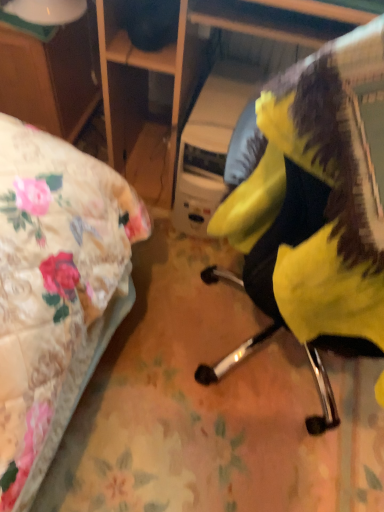
Image resolution: width=384 pixels, height=512 pixels. Describe the element at coordinates (317, 199) in the screenshot. I see `yellow fabric chair at center` at that location.

I want to click on yellow fabric chair at center, so click(317, 199).

You are a GUI agent. You are given a task and a screenshot of the screen. Output one action in this format:
    pyautogui.click(x=<x>, y=<y>)
    Task: Click on the wooden desk at left
    The height and width of the screenshot is (512, 384).
    Given the screenshot: What is the action you would take?
    pyautogui.click(x=51, y=76)

Describe the element at coordinates (51, 76) in the screenshot. I see `wooden desk at left` at that location.

Image resolution: width=384 pixels, height=512 pixels. Find the location of `yellow fabric chair at center`. yellow fabric chair at center is located at coordinates (317, 199).

Based on their positions, is yellow fabric chair at center located to the left or right of wooden desk at left?

In the image, yellow fabric chair at center appears on the right side of wooden desk at left.

Which is in front, yellow fabric chair at center or wooden desk at left?

yellow fabric chair at center is in front.

Does point (347, 96) come behind point (75, 77)?

No, (347, 96) is closer to viewer.

From the image's perspective, is yellow fabric chair at center located beneath wooden desk at left?

Indeed, from the image's perspective, yellow fabric chair at center is shown beneath wooden desk at left.

From a real-world perspective, between yellow fabric chair at center and wooden desk at left, who is vertically higher?

yellow fabric chair at center is physically above.

Does yellow fabric chair at center have a greater width compared to wooden desk at left?

Yes, yellow fabric chair at center is wider than wooden desk at left.

Does yellow fabric chair at center have a lesser height compared to wooden desk at left?

Incorrect, the height of yellow fabric chair at center does not fall short of that of wooden desk at left.

Which of these two, yellow fabric chair at center or wooden desk at left, is smaller?

yellow fabric chair at center is smaller.

Is yellow fabric chair at center positioned beyond the bounds of wooden desk at left?

Yes.

In the scene shown: Is there a large distance between yellow fabric chair at center and wooden desk at left?

Yes, yellow fabric chair at center and wooden desk at left are located far from each other.

Could you tell me if yellow fabric chair at center is turned towards wooden desk at left?

No, yellow fabric chair at center is not aimed at wooden desk at left.

Measure the distance between yellow fabric chair at center and wooden desk at left.

yellow fabric chair at center and wooden desk at left are 1.18 meters apart from each other.

Locate an element on the screen. desk that appears behind the yellow fabric chair at center is located at coordinates (51, 76).

Can you confirm if wooden desk at left is positioned to the right of yellow fabric chair at center?

Incorrect, wooden desk at left is not on the right side of yellow fabric chair at center.

Is wooden desk at left in front of or behind yellow fabric chair at center in the image?

wooden desk at left is behind yellow fabric chair at center.

Is point (28, 48) closer to viewer compared to point (261, 94)?

No, (28, 48) is further to viewer.

From the image's perspective, is wooden desk at left above yellow fabric chair at center?

Yes, from the image's perspective, wooden desk at left is over yellow fabric chair at center.

From a real-world perspective, which object stands above the other?

From a 3D spatial view, yellow fabric chair at center is above.

Looking at their sizes, would you say wooden desk at left is wider or thinner than yellow fabric chair at center?

In the image, wooden desk at left appears to be more narrow than yellow fabric chair at center.

Considering the relative sizes of wooden desk at left and yellow fabric chair at center in the image provided, is wooden desk at left shorter than yellow fabric chair at center?

Yes.

Consider the image. Considering the relative sizes of wooden desk at left and yellow fabric chair at center in the image provided, is wooden desk at left smaller than yellow fabric chair at center?

Actually, wooden desk at left might be larger than yellow fabric chair at center.

Is wooden desk at left positioned beyond the bounds of yellow fabric chair at center?

Yes.

Is wooden desk at left not near yellow fabric chair at center?

Yes, wooden desk at left and yellow fabric chair at center are located far from each other.

Is wooden desk at left oriented towards yellow fabric chair at center?

No, wooden desk at left is not facing towards yellow fabric chair at center.

How distant is wooden desk at left from yellow fabric chair at center?

They are 3.86 feet apart.

What are the coordinates of `desk that is under the yellow fabric chair at center (from a real-world perspective)` in the screenshot? It's located at (51, 76).

Where is `chair in front of the wooden desk at left`? The height and width of the screenshot is (512, 384). chair in front of the wooden desk at left is located at coordinates (317, 199).

The height and width of the screenshot is (512, 384). I want to click on desk above the yellow fabric chair at center (from the image's perspective), so click(51, 76).